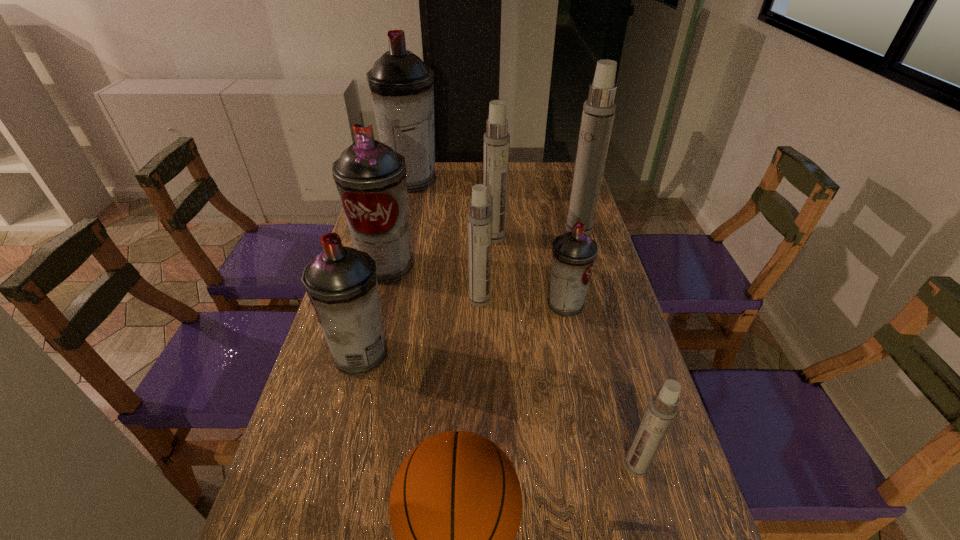
Find the location of a particular element. This screenshot has width=960, height=540. vacant space located on the left of the nearest aerosol can is located at coordinates (476, 466).

Find the location of a particular element. The image size is (960, 540). object present at the far edge is located at coordinates 402,88.

The image size is (960, 540). I want to click on object that is at the far left corner, so click(x=402, y=88).

The width and height of the screenshot is (960, 540). What are the coordinates of `vacant space at the far edge of the desktop` in the screenshot? It's located at (443, 171).

In the image, there is a desktop. Identify the location of vacant space at the left edge. Image resolution: width=960 pixels, height=540 pixels. (337, 505).

Locate an element on the screen. vacant space at the right edge of the desktop is located at coordinates (567, 206).

This screenshot has height=540, width=960. I want to click on free space between the biggest gray aerosol can and the second smallest white aerosol can, so click(x=445, y=240).

Identify the location of vacant area that lies between the second nearest white aerosol can and the sixth nearest object. The height and width of the screenshot is (540, 960). (433, 283).

At what (x,y) coordinates should I click in order to perform the action: click on vacant space that is in between the nearest white aerosol can and the smallest gray aerosol can. Please return your answer as a coordinate pair (x, y). The width and height of the screenshot is (960, 540). Looking at the image, I should click on [x=601, y=386].

Identify the location of the fifth closest object relative to the nearest white aerosol can. This screenshot has height=540, width=960. (370, 176).